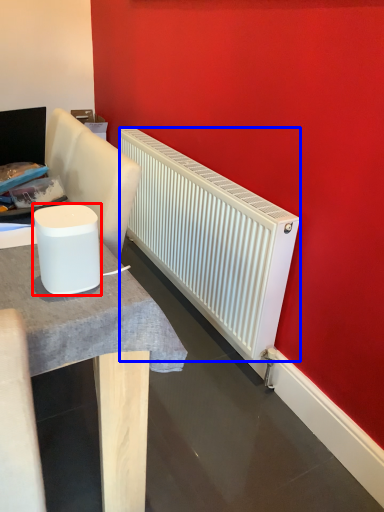
Question: Which object is closer to the camera taking this photo, appliance (highlighted by a red box) or radiator (highlighted by a blue box)?

Choices:
 (A) appliance
 (B) radiator

Answer: (A)